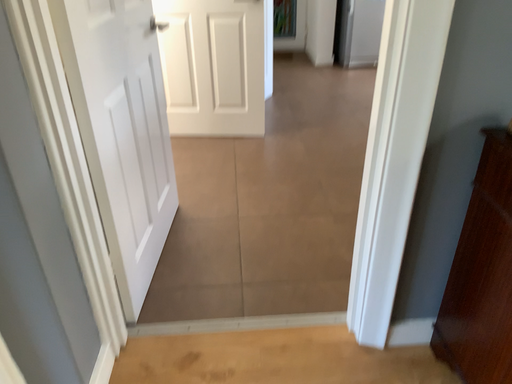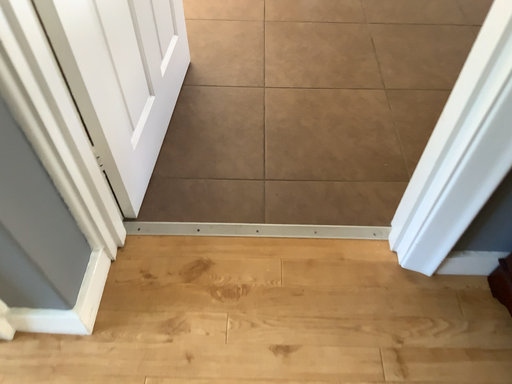
Question: How did the camera likely rotate when shooting the video?

Choices:
 (A) rotated upward
 (B) rotated downward

Answer: (B)